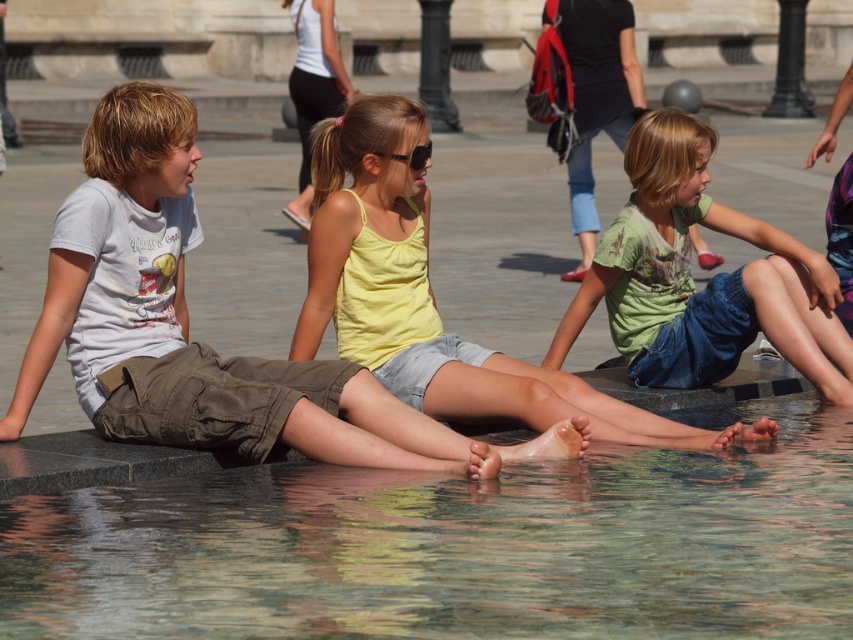
You are a photographer trying to capture a shot of the clear glass water at lower center and the yellow cotton tank top at center. You want to ensure both subjects are fully visible in the frame. Based on their sizes, is there a risk that one might block the view of the other?

The clear glass water at lower center might be wider than yellow cotton tank top at center, so there is a possibility that the wider clear glass water at lower center could block the view of the yellow cotton tank top at center if not positioned carefully.

You are a lifeguard standing at the edge of the water. You need to retrieve an object from the clear glass water at lower center while also ensuring the yellow cotton tank top at center stays dry. Can you reach the water without getting the tank top wet?

The distance between the clear glass water at lower center and the yellow cotton tank top at center is 2.05 meters. Since you can reach the water without needing to move closer than that distance, you can safely retrieve the object without getting the tank top wet.